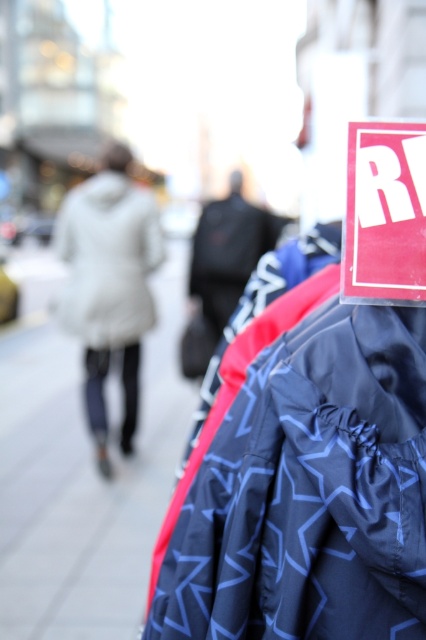
In the scene shown: Who is positioned more to the left, gray concrete pavement at lower left or red paper sign at upper right?

Positioned to the left is gray concrete pavement at lower left.

Who is more forward, (154, 348) or (340, 288)?

Point (340, 288)

Between point (66, 598) and point (408, 208), which one is positioned in front?

Point (408, 208)

At what (x,y) coordinates should I click in order to perform the action: click on gray concrete pavement at lower left. Please return your answer as a coordinate pair (x, y). The height and width of the screenshot is (640, 426). Looking at the image, I should click on (83, 467).

Does point (45, 426) come closer to viewer compared to point (106, 296)?

No, it is behind (106, 296).

Between gray concrete pavement at lower left and white down coat at left, which one is positioned lower?

white down coat at left is below.

You are a GUI agent. You are given a task and a screenshot of the screen. Output one action in this format:
    pyautogui.click(x=<x>, y=<y>)
    Task: Click on the gray concrete pavement at lower left
    The height and width of the screenshot is (640, 426).
    Given the screenshot: What is the action you would take?
    pyautogui.click(x=83, y=467)

Based on the photo, how far apart are gray concrete pavement at lower left and black matte coat at center?

gray concrete pavement at lower left and black matte coat at center are 5.05 feet apart from each other.

Can you confirm if gray concrete pavement at lower left is taller than black matte coat at center?

A: Yes, gray concrete pavement at lower left is taller than black matte coat at center.

Is point (129, 624) positioned behind point (203, 273)?

That is False.

At what (x,y) coordinates should I click in order to perform the action: click on gray concrete pavement at lower left. Please return your answer as a coordinate pair (x, y). Looking at the image, I should click on (83, 467).